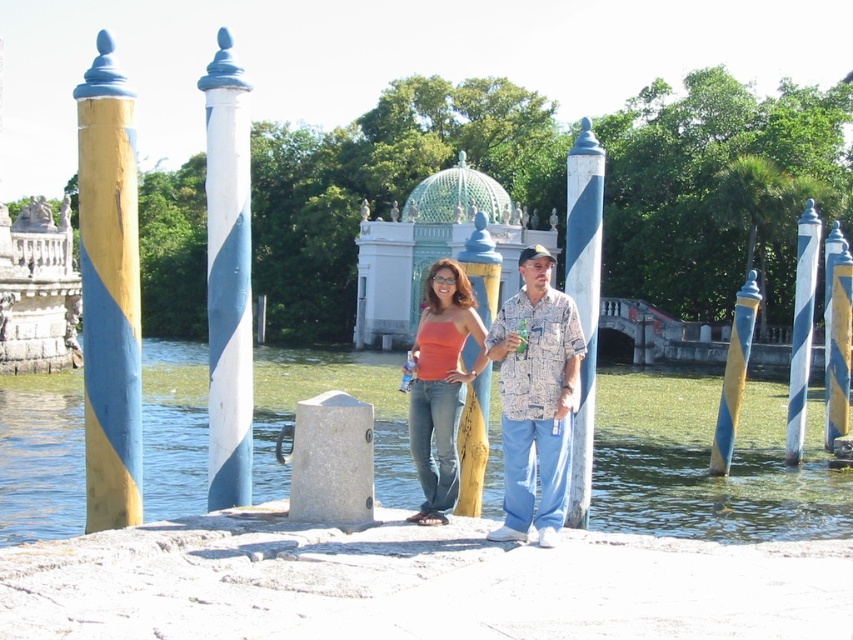
Between green mosaic dome at center and yellow painted wood post at center, which one is positioned lower?

yellow painted wood post at center is lower down.

Image resolution: width=853 pixels, height=640 pixels. What do you see at coordinates (433, 248) in the screenshot?
I see `green mosaic dome at center` at bounding box center [433, 248].

Identify the location of green mosaic dome at center. The image size is (853, 640). (433, 248).

Consider the image. Who is higher up, green mosaic dome at center or blue painted wood post at center?

blue painted wood post at center is higher up.

Is point (490, 220) positioned before point (601, 202)?

No, (490, 220) is further to viewer.

The height and width of the screenshot is (640, 853). What do you see at coordinates (433, 248) in the screenshot?
I see `green mosaic dome at center` at bounding box center [433, 248].

The width and height of the screenshot is (853, 640). I want to click on green mosaic dome at center, so click(x=433, y=248).

Measure the distance between point (123, 500) and camera.

Point (123, 500) and camera are 26.91 meters apart.

Can you confirm if yellow and blue striped post at left is positioned below blue painted wood post at center?

Yes.

Image resolution: width=853 pixels, height=640 pixels. What are the coordinates of `yellow and blue striped post at left` in the screenshot? It's located at (109, 292).

Locate an element on the screen. This screenshot has height=640, width=853. yellow and blue striped post at left is located at coordinates (109, 292).